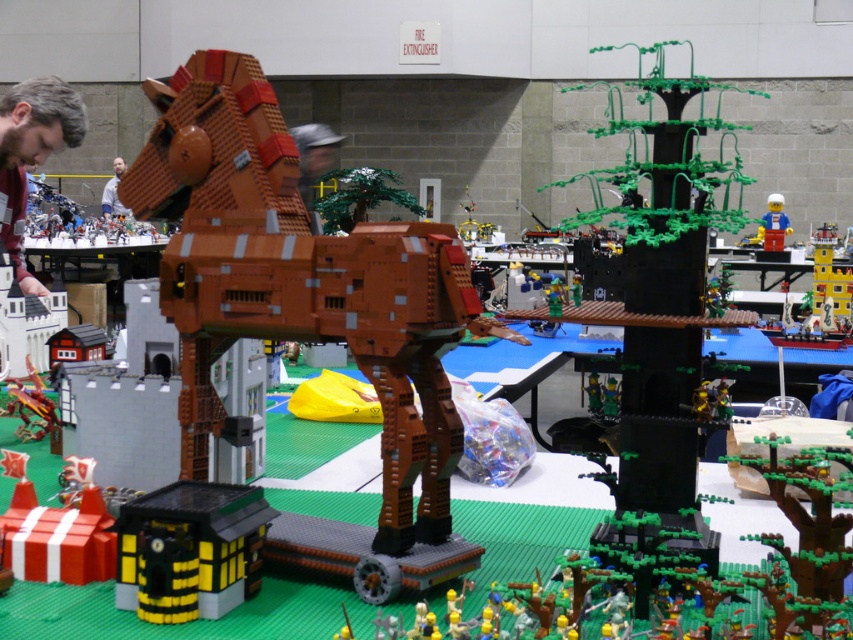
You are a photographer at the Lego exhibition and need to capture a clear shot of both the brown hair at upper left and the light blue shirt at upper left. Based on their sizes, which one should you focus on first to ensure it fits in the frame?

The brown hair at upper left occupies less space than the light blue shirt at upper left, so you should focus on the light blue shirt at upper left first to ensure it fits in the frame since it is larger and requires more attention to composition.

You are a Lego enthusiast observing the display. You notice the brown hair at upper left and the blue plastic minifigure at center. Which of these two objects is shorter in height?

The brown hair at upper left is shorter than the blue plastic minifigure at center according to the description provided.